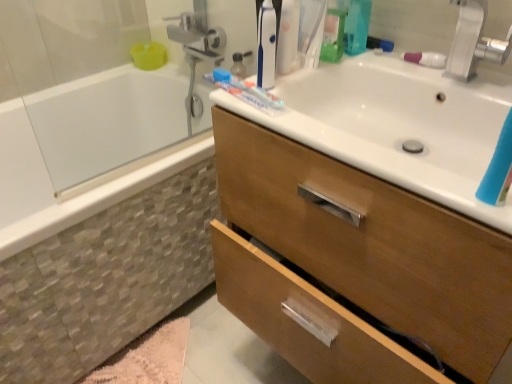
What do you see at coordinates (426, 59) in the screenshot?
I see `pink plastic toothbrush at upper right` at bounding box center [426, 59].

What is the approximate width of silver metallic faucet at upper right?

4.81 centimeters.

Measure the distance between silver metallic faucet at upper right and camera.

The depth of silver metallic faucet at upper right is 29.67 inches.

What is the approximate width of blue plastic toothbrush at upper center?

blue plastic toothbrush at upper center is 1.61 inches wide.

In order to click on blue plastic toothbrush at upper center in this screenshot , I will do `click(266, 46)`.

The height and width of the screenshot is (384, 512). Find the location of `pink fluffy bath mat at lower left`. pink fluffy bath mat at lower left is located at coordinates (147, 358).

Image resolution: width=512 pixels, height=384 pixels. Describe the element at coordinates (398, 124) in the screenshot. I see `white glossy sink at upper right` at that location.

You are a GUI agent. You are given a task and a screenshot of the screen. Output one action in this format:
    pyautogui.click(x=<x>, y=<y>)
    Task: Click on the wooden cabinet at upper right
    Image resolution: width=512 pixels, height=384 pixels.
    Given the screenshot: What is the action you would take?
    pyautogui.click(x=372, y=243)

Which of these two, white glossy sink at upper right or silver metallic faucet at upper right, is thinner?

silver metallic faucet at upper right is thinner.

From the image's perspective, which is below, white glossy sink at upper right or silver metallic faucet at upper right?

white glossy sink at upper right, from the image's perspective.

Can you see white glossy sink at upper right touching silver metallic faucet at upper right?

No, white glossy sink at upper right is not touching silver metallic faucet at upper right.

From a real-world perspective, is white glossy sink at upper right positioned above or below silver metallic faucet at upper right?

In terms of real-world spatial position, white glossy sink at upper right is below silver metallic faucet at upper right.

Is silver metallic faucet at upper right to the left or to the right of pink fluffy bath mat at lower left in the image?

In the image, silver metallic faucet at upper right appears on the right side of pink fluffy bath mat at lower left.

Which point is more distant from viewer, (509, 41) or (181, 350)?

The point (181, 350) is behind.

Does silver metallic faucet at upper right have a larger size compared to pink fluffy bath mat at lower left?

No.

From a real-world perspective, which is physically below, silver metallic faucet at upper right or pink fluffy bath mat at lower left?

In real-world perspective, pink fluffy bath mat at lower left is lower.

In the scene shown: Between pink plastic toothbrush at upper right and white glossy bathtub at left, which one has less height?

Standing shorter between the two is pink plastic toothbrush at upper right.

The image size is (512, 384). In the image, there is a white glossy bathtub at left. Find the location of `toothbrush above it (from the image's perspective)`. toothbrush above it (from the image's perspective) is located at coordinates (426, 59).

From the image's perspective, is pink plastic toothbrush at upper right located above white glossy bathtub at left?

Correct, pink plastic toothbrush at upper right appears higher than white glossy bathtub at left in the image.

Is pink plastic toothbrush at upper right positioned with its back to white glossy bathtub at left?

That's not correct — pink plastic toothbrush at upper right is not looking away from white glossy bathtub at left.

Which object is further away from the camera, white glossy bathtub at left or translucent plastic toothpaste at upper center?

translucent plastic toothpaste at upper center is behind.

Is white glossy bathtub at left to the left of translucent plastic toothpaste at upper center from the viewer's perspective?

Yes.

From a real-world perspective, which is physically below, white glossy bathtub at left or translucent plastic toothpaste at upper center?

From a 3D spatial view, white glossy bathtub at left is below.

From the image's perspective, is white glossy bathtub at left under translucent plastic toothpaste at upper center?

Yes, from the image's perspective, white glossy bathtub at left is beneath translucent plastic toothpaste at upper center.

Is white glossy sink at upper right next to blue plastic toothbrush at upper center?

white glossy sink at upper right and blue plastic toothbrush at upper center are clearly separated.

Who is bigger, white glossy sink at upper right or blue plastic toothbrush at upper center?

white glossy sink at upper right.

Considering the relative positions of white glossy sink at upper right and blue plastic toothbrush at upper center in the image provided, is white glossy sink at upper right to the right of blue plastic toothbrush at upper center from the viewer's perspective?

Indeed, white glossy sink at upper right is positioned on the right side of blue plastic toothbrush at upper center.

Looking at their sizes, would you say white glossy sink at upper right is wider or thinner than blue plastic toothbrush at upper center?

Considering their sizes, white glossy sink at upper right looks broader than blue plastic toothbrush at upper center.

Is white glossy bathtub at left oriented towards pink fluffy bath mat at lower left?

Yes.

You are a GUI agent. You are given a task and a screenshot of the screen. Output one action in this format:
    pyautogui.click(x=<x>, y=<y>)
    Task: Click on the bath mat below the white glossy bathtub at left (from the image's perspective)
    Image resolution: width=512 pixels, height=384 pixels.
    Given the screenshot: What is the action you would take?
    pyautogui.click(x=147, y=358)

Based on their sizes in the image, would you say white glossy bathtub at left is bigger or smaller than pink fluffy bath mat at lower left?

white glossy bathtub at left is bigger than pink fluffy bath mat at lower left.

From the image's perspective, is white glossy bathtub at left positioned above or below pink fluffy bath mat at lower left?

Based on their image positions, white glossy bathtub at left is located above pink fluffy bath mat at lower left.

Who is more distant, pink fluffy bath mat at lower left or translucent plastic toothpaste at upper center?

Positioned behind is translucent plastic toothpaste at upper center.

This screenshot has height=384, width=512. I want to click on toothpaste located above the pink fluffy bath mat at lower left (from the image's perspective), so click(x=244, y=89).

Which point is more forward, (175, 350) or (263, 93)?

The point (263, 93) is more forward.

Looking at this image, which of these two, pink fluffy bath mat at lower left or translucent plastic toothpaste at upper center, is wider?

pink fluffy bath mat at lower left.

Find the location of a particular element. The height and width of the screenshot is (384, 512). tap above the white glossy sink at upper right (from a real-world perspective) is located at coordinates (473, 42).

The image size is (512, 384). Identify the location of bath mat on the left of silver metallic faucet at upper right. (147, 358).

Looking at the image, which one is located further to silver metallic faucet at upper right, white glossy bathtub at left or pink fluffy bath mat at lower left?

Among the two, pink fluffy bath mat at lower left is located further to silver metallic faucet at upper right.

Consider the image. Looking at the image, which one is located closer to white glossy bathtub at left, pink plastic toothbrush at upper right or white glossy sink at upper right?

Among the two, white glossy sink at upper right is located nearer to white glossy bathtub at left.

When comparing their distances from white glossy bathtub at left, does silver metallic faucet at upper right or translucent plastic toothpaste at upper center seem closer?

translucent plastic toothpaste at upper center is positioned closer to the anchor white glossy bathtub at left.

Estimate the real-world distances between objects in this image. Which object is further from white glossy sink at upper right, pink plastic toothbrush at upper right or translucent plastic toothpaste at upper center?

translucent plastic toothpaste at upper center lies further to white glossy sink at upper right than the other object.

From the image, which object appears to be nearer to blue plastic toothbrush at upper center, translucent plastic toothpaste at upper center or white glossy sink at upper right?

translucent plastic toothpaste at upper center.

Considering their positions, is pink fluffy bath mat at lower left positioned further to pink plastic toothbrush at upper right than silver metallic faucet at upper right?

pink fluffy bath mat at lower left lies further to pink plastic toothbrush at upper right than the other object.

When comparing their distances from white glossy sink at upper right, does wooden cabinet at upper right or blue plastic toothbrush at upper center seem closer?

Among the two, wooden cabinet at upper right is located nearer to white glossy sink at upper right.

Based on their spatial positions, is translucent plastic toothpaste at upper center or white glossy sink at upper right further from wooden cabinet at upper right?

translucent plastic toothpaste at upper center lies further to wooden cabinet at upper right than the other object.

You are a GUI agent. You are given a task and a screenshot of the screen. Output one action in this format:
    pyautogui.click(x=<x>, y=<y>)
    Task: Click on the sink between pink plastic toothbrush at upper right and wooden cabinet at upper right from top to bottom
    The height and width of the screenshot is (384, 512).
    Given the screenshot: What is the action you would take?
    pyautogui.click(x=398, y=124)

Identify the location of toothbrush between translucent plastic toothpaste at upper center and pink fluffy bath mat at lower left in the vertical direction. The width and height of the screenshot is (512, 384). (426, 59).

Locate an element on the screen. toothbrush between white glossy bathtub at left and silver metallic faucet at upper right in the horizontal direction is located at coordinates (426, 59).

Locate an element on the screen. This screenshot has height=384, width=512. sink between blue plastic toothbrush at upper center and wooden cabinet at upper right in the vertical direction is located at coordinates (398, 124).